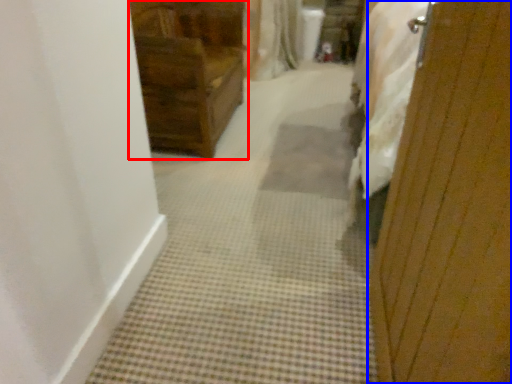
Question: Which point is further to the camera, furniture (highlighted by a red box) or screen door (highlighted by a blue box)?

Choices:
 (A) furniture
 (B) screen door

Answer: (A)